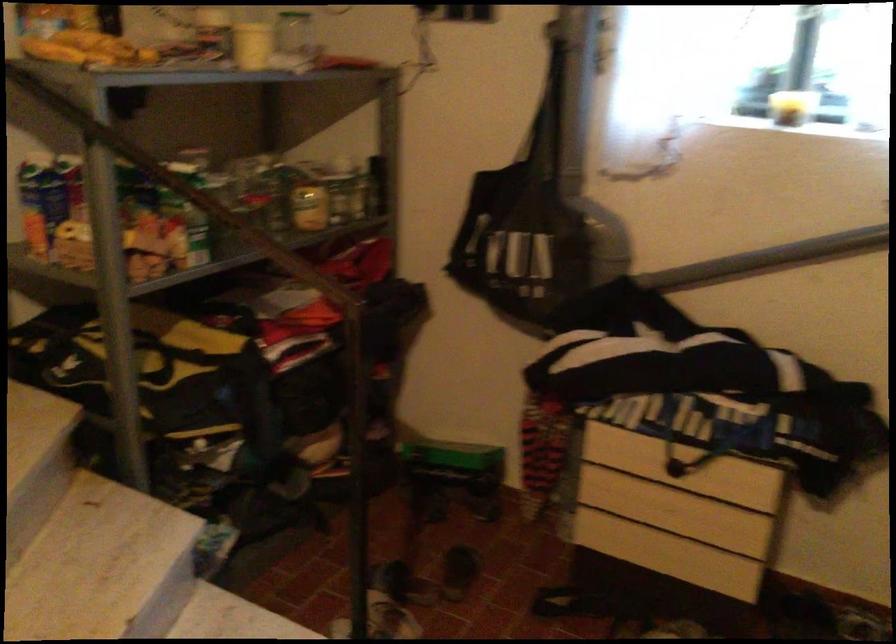
Question: The camera is either moving clockwise (left) or counter-clockwise (right) around the object. The first image is from the beginning of the video and the second image is from the end. Is the camera moving left or right when shooting the video?

Choices:
 (A) Left
 (B) Right

Answer: (A)